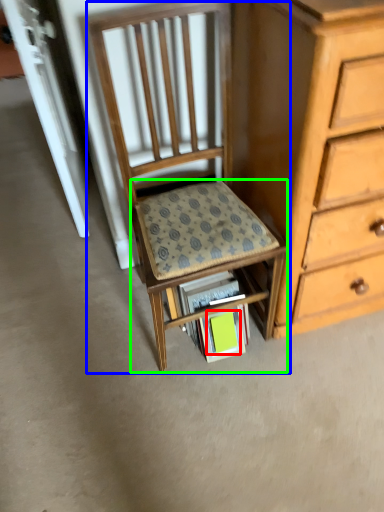
Question: Based on their relative distances, which object is farther from paperback book (highlighted by a red box)? Choose from chair (highlighted by a blue box) and step stool (highlighted by a green box).

Choices:
 (A) chair
 (B) step stool

Answer: (A)